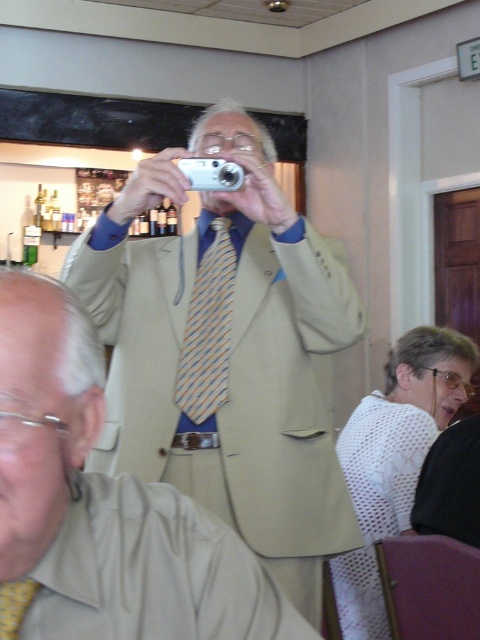
Does silver metallic camera at upper center appear on the right side of yellowtexturetie at center?

Yes, silver metallic camera at upper center is to the right of yellowtexturetie at center.

Can you confirm if silver metallic camera at upper center is positioned below yellowtexturetie at center?

Actually, silver metallic camera at upper center is above yellowtexturetie at center.

What do you see at coordinates (212, 173) in the screenshot?
I see `silver metallic camera at upper center` at bounding box center [212, 173].

Where is `silver metallic camera at upper center`? The height and width of the screenshot is (640, 480). silver metallic camera at upper center is located at coordinates point(212,173).

Between point (206, 358) and point (3, 634), which one is positioned in front?

Point (3, 634) is more forward.

Is yellow striped tie at center closer to camera compared to yellowtexturetie at center?

That is False.

Is point (223, 221) farther from viewer compared to point (13, 588)?

Yes, point (223, 221) is farther from viewer.

Locate an element on the screen. yellow striped tie at center is located at coordinates (206, 333).

Is beige fabric suit at center taller than silver metallic camera at upper center?

Yes, beige fabric suit at center is taller than silver metallic camera at upper center.

Based on the photo, who is taller, beige fabric suit at center or silver metallic camera at upper center?

With more height is beige fabric suit at center.

Image resolution: width=480 pixels, height=640 pixels. Find the location of `beige fabric suit at center`. beige fabric suit at center is located at coordinates (226, 353).